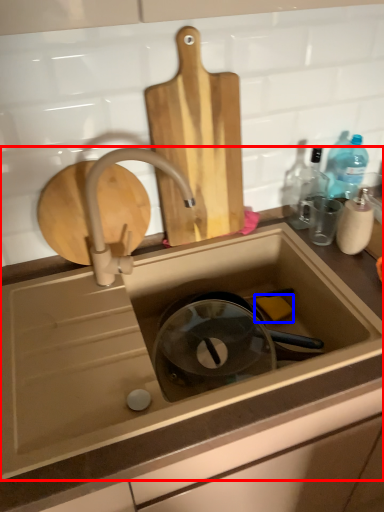
Question: Which point is further to the camera, sink (highlighted by a red box) or soap (highlighted by a blue box)?

Choices:
 (A) sink
 (B) soap

Answer: (B)